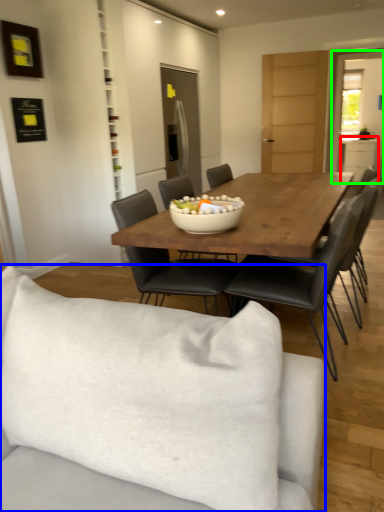
Question: Based on their relative distances, which object is nearer to cabinetry (highlighted by a red box)? Choose from studio couch (highlighted by a blue box) and glass door (highlighted by a green box).

Choices:
 (A) studio couch
 (B) glass door

Answer: (B)